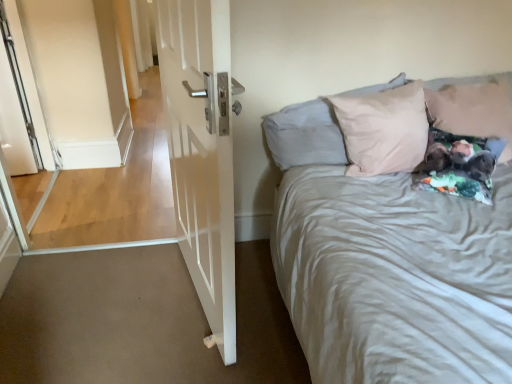
You are a GUI agent. You are given a task and a screenshot of the screen. Output one action in this format:
    pyautogui.click(x=<x>, y=<y>)
    Task: Click on the blank area to the left of white glossy door at left
    This screenshot has height=384, width=512.
    Given the screenshot: What is the action you would take?
    pyautogui.click(x=103, y=300)